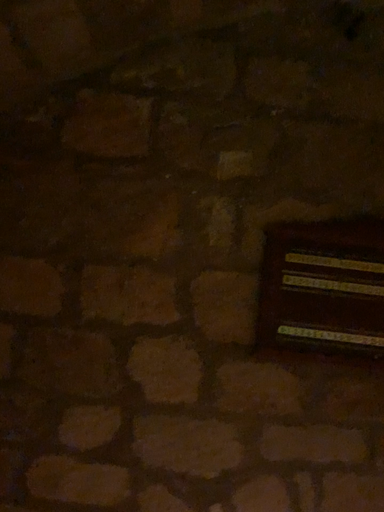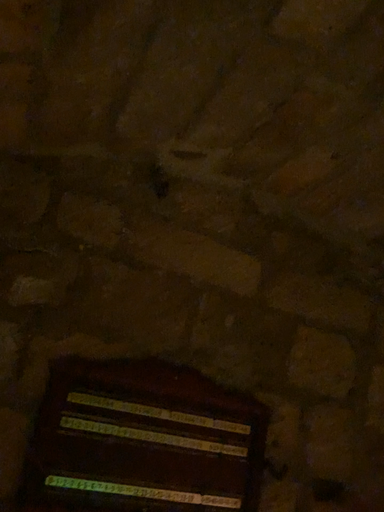
Question: Which way did the camera rotate in the video?

Choices:
 (A) rotated left
 (B) rotated right

Answer: (B)